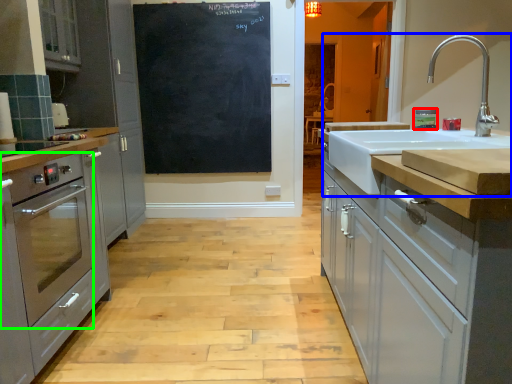
Question: Which object is positioned farthest from appliance (highlighted by a red box)? Select from sink (highlighted by a blue box) and home appliance (highlighted by a green box).

Choices:
 (A) sink
 (B) home appliance

Answer: (B)